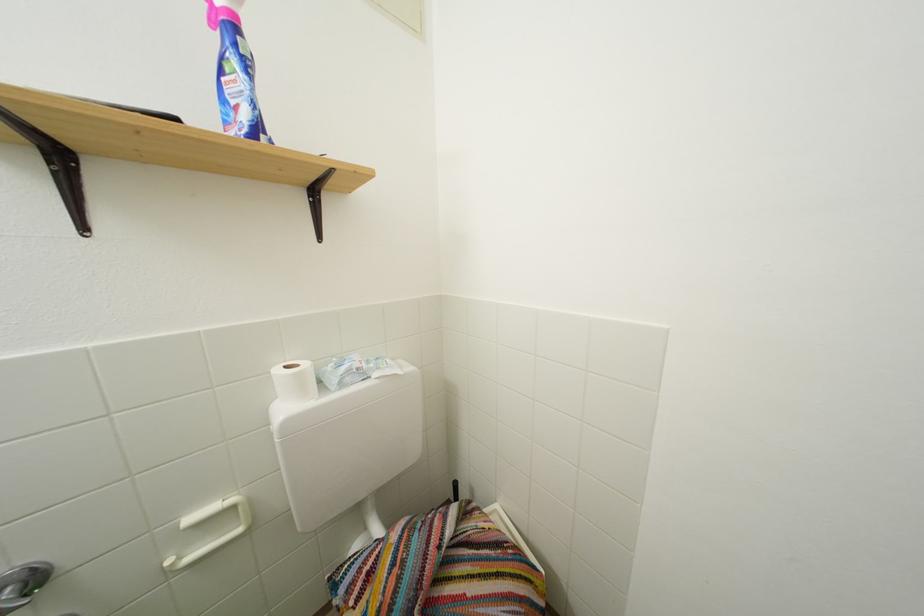
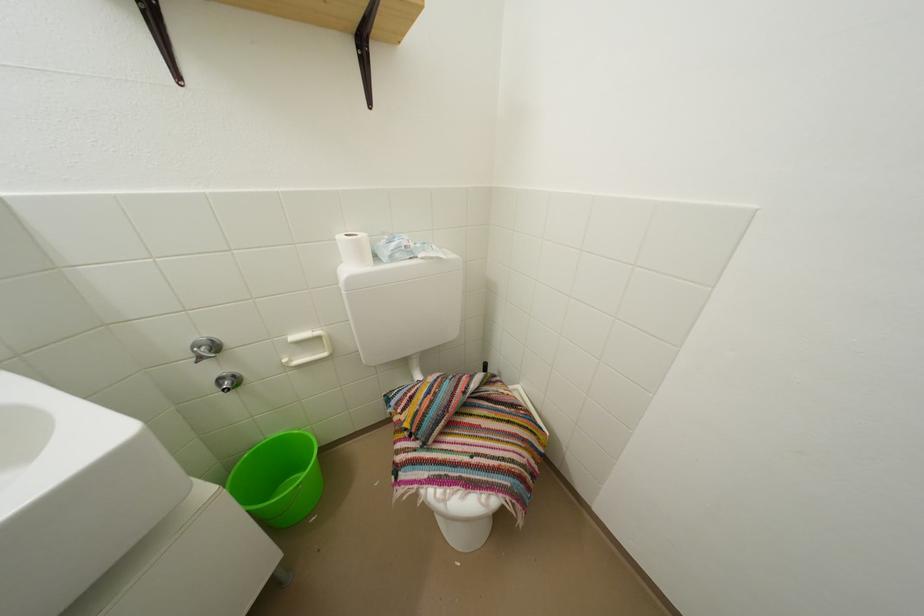
What movement of the cameraman would produce the second image?

The cameraman moved toward right, backward.